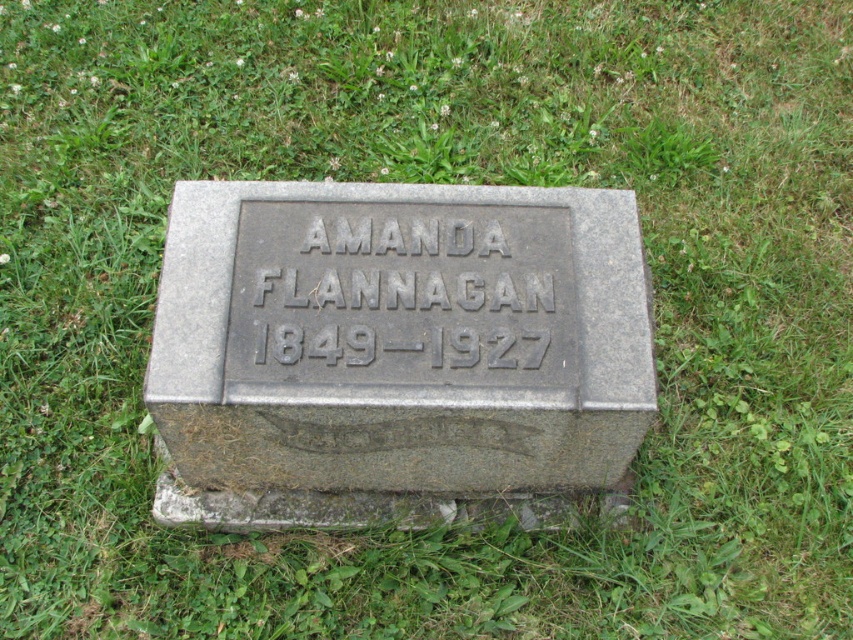
Question: Does gray stone gravestone at center have a smaller size compared to black engraved stone at center?

Choices:
 (A) yes
 (B) no

Answer: (B)

Question: Which of the following is the farthest from the observer?

Choices:
 (A) gray stone gravestone at center
 (B) black engraved stone at center

Answer: (B)

Question: Does gray stone gravestone at center have a lesser width compared to black engraved stone at center?

Choices:
 (A) no
 (B) yes

Answer: (A)

Question: Which point is farther to the camera?

Choices:
 (A) black engraved stone at center
 (B) gray stone gravestone at center

Answer: (A)

Question: Which of the following is the closest to the observer?

Choices:
 (A) black engraved stone at center
 (B) gray stone gravestone at center

Answer: (B)

Question: Does gray stone gravestone at center appear under black engraved stone at center?

Choices:
 (A) yes
 (B) no

Answer: (A)